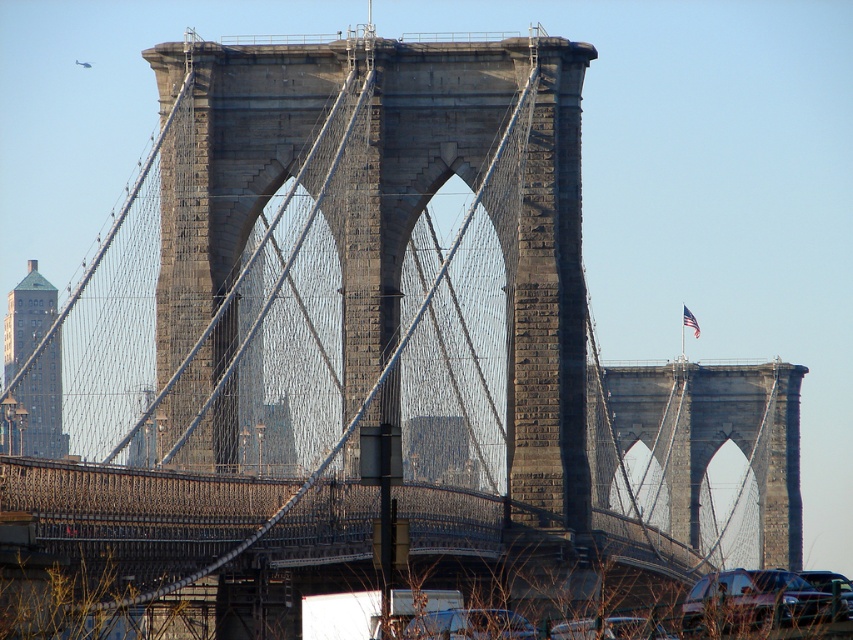
Is point (686, 632) farther from camera compared to point (627, 630)?

No, (686, 632) is closer to viewer.

Is the position of shiny black sedan at lower right less distant than that of shiny black car at lower center?

Yes, shiny black sedan at lower right is in front of shiny black car at lower center.

The image size is (853, 640). Describe the element at coordinates (756, 602) in the screenshot. I see `shiny black sedan at lower right` at that location.

Where is `shiny black sedan at lower right`? Image resolution: width=853 pixels, height=640 pixels. shiny black sedan at lower right is located at coordinates (756, 602).

How distant is shiny black sedan at lower right from metallic silver car at lower center?

They are 41.31 feet apart.

Is shiny black sedan at lower right positioned behind metallic silver car at lower center?

No, it is not.

This screenshot has width=853, height=640. In order to click on shiny black sedan at lower right in this screenshot , I will do `click(756, 602)`.

Identify the location of shiny black sedan at lower right. This screenshot has height=640, width=853. (756, 602).

Is point (486, 612) positioned after point (628, 637)?

That is True.

Is metallic silver car at lower center taller than shiny black car at lower center?

Yes, metallic silver car at lower center is taller than shiny black car at lower center.

Which is in front, point (463, 609) or point (648, 625)?

Positioned in front is point (648, 625).

At what (x,y) coordinates should I click in order to perform the action: click on metallic silver car at lower center. Please return your answer as a coordinate pair (x, y). The height and width of the screenshot is (640, 853). Looking at the image, I should click on (469, 625).